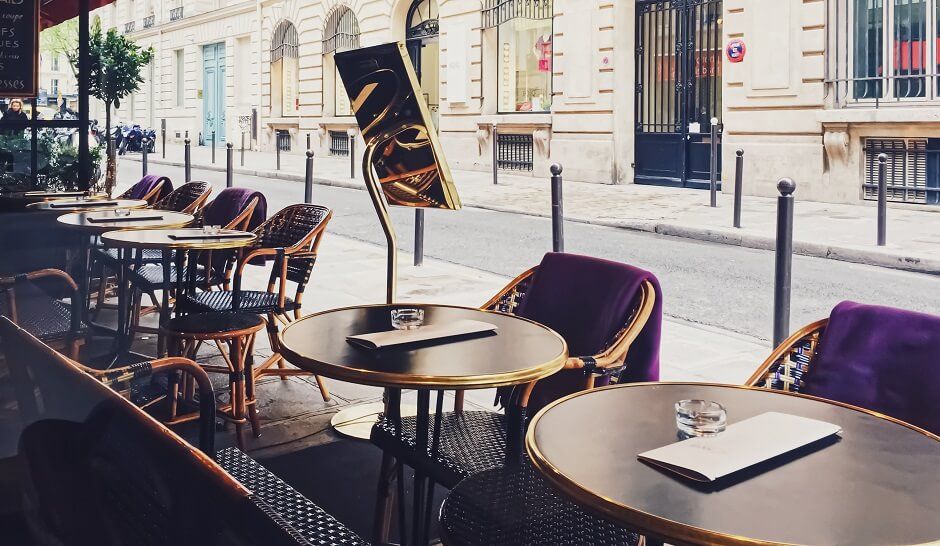
I want to click on tables, so click(588, 452), click(515, 352), click(152, 241), click(174, 216), click(128, 204).